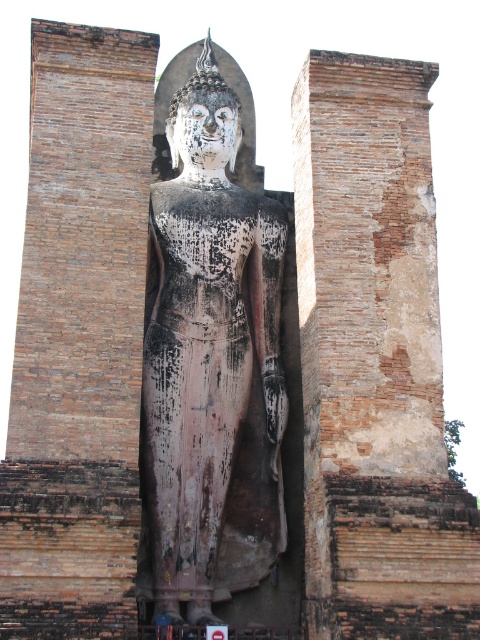
You are standing in front of the ancient temple structure. You see the brown textured stone pillar at center and the blackened stone statue at center. Which object is nearer to you?

The brown textured stone pillar at center is closer to the viewer than the blackened stone statue at center, so the brown textured stone pillar at center is nearer to you.

You are an architect examining the ancient temple structure. You notice the brown textured stone pillar at center and the blackened stone statue at center. Which object is positioned lower in the scene?

The brown textured stone pillar at center is located below the blackened stone statue at center, so it is positioned lower in the scene.

You are an architect examining the temple structure. You need to locate the brown textured stone pillar at center. Where would you find it in the image?

The brown textured stone pillar at center is located at point (374,360).